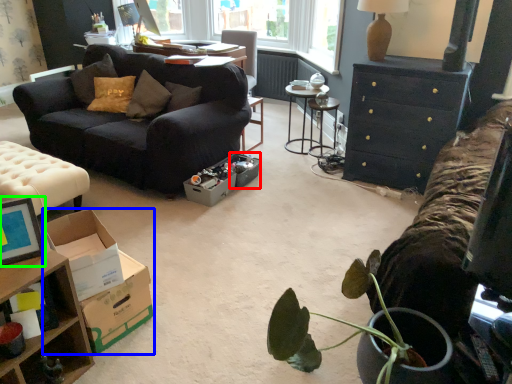
Question: Which object is the closest to the box (highlighted by a red box)? Choose among these: cardboard box (highlighted by a blue box) or picture frame (highlighted by a green box).

Choices:
 (A) cardboard box
 (B) picture frame

Answer: (A)